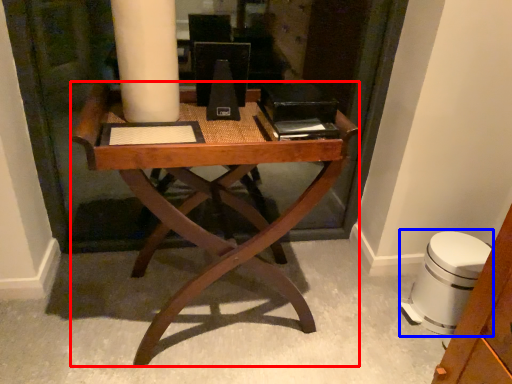
Question: Among these objects, which one is nearest to the camera, desk (highlighted by a red box) or swivel chair (highlighted by a blue box)?

Choices:
 (A) desk
 (B) swivel chair

Answer: (A)